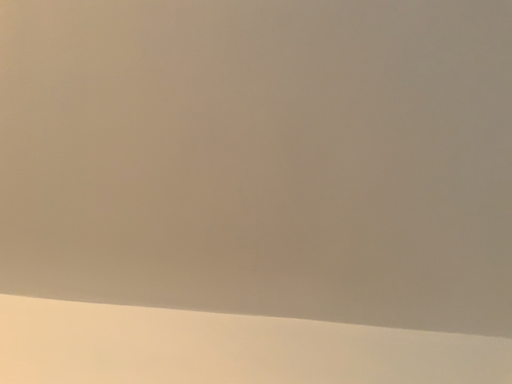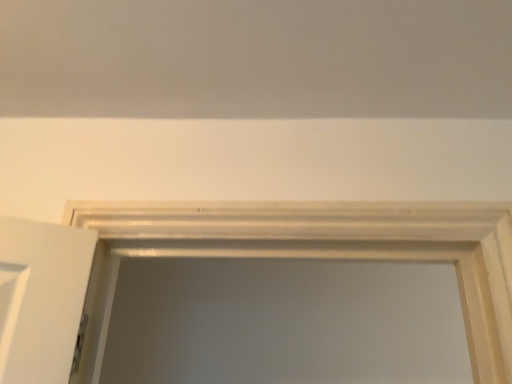
Question: Which way did the camera rotate in the video?

Choices:
 (A) rotated downward
 (B) rotated upward

Answer: (A)